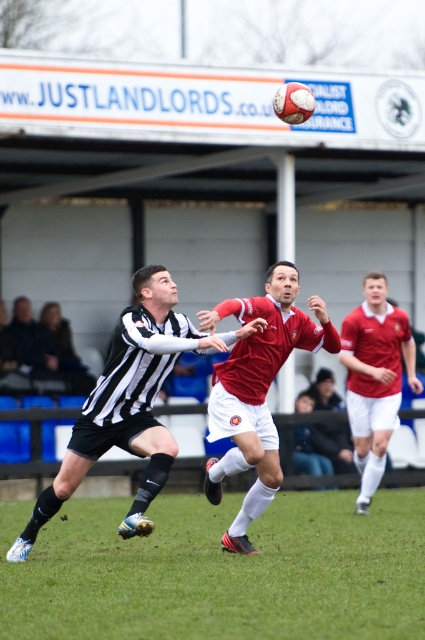
Who is taller, green grass at center or red matte soccer player at center?

Standing taller between the two is red matte soccer player at center.

Is green grass at center positioned behind red matte soccer player at center?

No, green grass at center is closer to the viewer.

Who is more forward, (325, 557) or (224, 376)?

Positioned in front is point (325, 557).

This screenshot has height=640, width=425. In order to click on green grass at center in this screenshot , I will do `click(220, 570)`.

Is red matte soccer player at center bigger than red jersey at right?

Correct, red matte soccer player at center is larger in size than red jersey at right.

Does red matte soccer player at center appear on the right side of red jersey at right?

Incorrect, red matte soccer player at center is not on the right side of red jersey at right.

Which is in front, point (209, 436) or point (359, 419)?

Point (209, 436) is more forward.

Image resolution: width=425 pixels, height=640 pixels. I want to click on red matte soccer player at center, so click(x=257, y=388).

Between green grass at center and black and white striped jersey at center, which one is positioned lower?

Positioned lower is green grass at center.

Does green grass at center have a lesser width compared to black and white striped jersey at center?

No.

The image size is (425, 640). What are the coordinates of `green grass at center` in the screenshot? It's located at (220, 570).